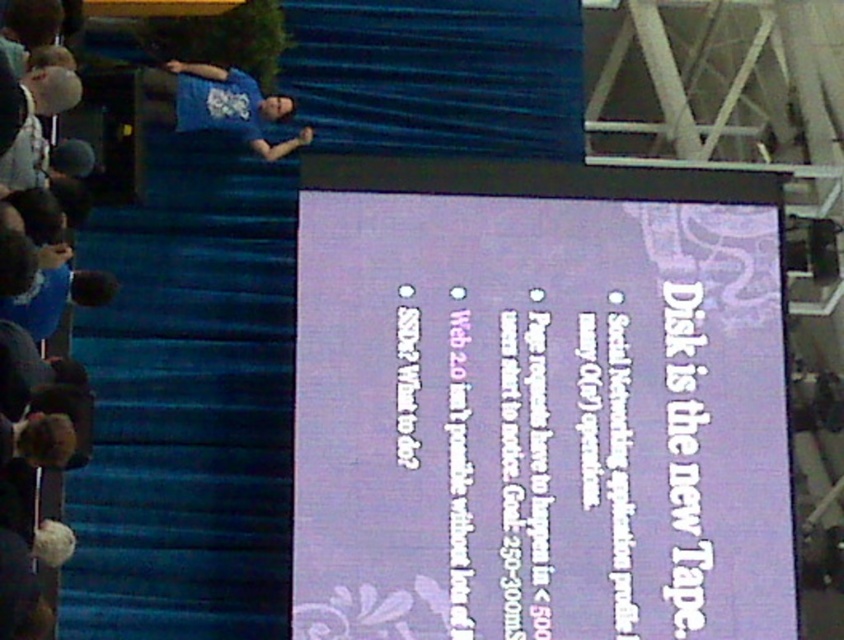
Question: Is blue t-shirt at left positioned behind blue t-shirt at upper left?

Choices:
 (A) yes
 (B) no

Answer: (B)

Question: Can you confirm if purple glossy projection screen at center is positioned to the left of blue t-shirt at left?

Choices:
 (A) yes
 (B) no

Answer: (B)

Question: Is blue t-shirt at left bigger than blue t-shirt at upper left?

Choices:
 (A) no
 (B) yes

Answer: (B)

Question: Which object is positioned farthest from the purple glossy projection screen at center?

Choices:
 (A) blue t-shirt at upper left
 (B) blue t-shirt at left

Answer: (B)

Question: Which point appears closest to the camera in this image?

Choices:
 (A) (14, 504)
 (B) (264, 145)
 (C) (549, 368)

Answer: (A)

Question: Estimate the real-world distances between objects in this image. Which object is closer to the blue t-shirt at upper left?

Choices:
 (A) blue t-shirt at left
 (B) purple glossy projection screen at center

Answer: (A)